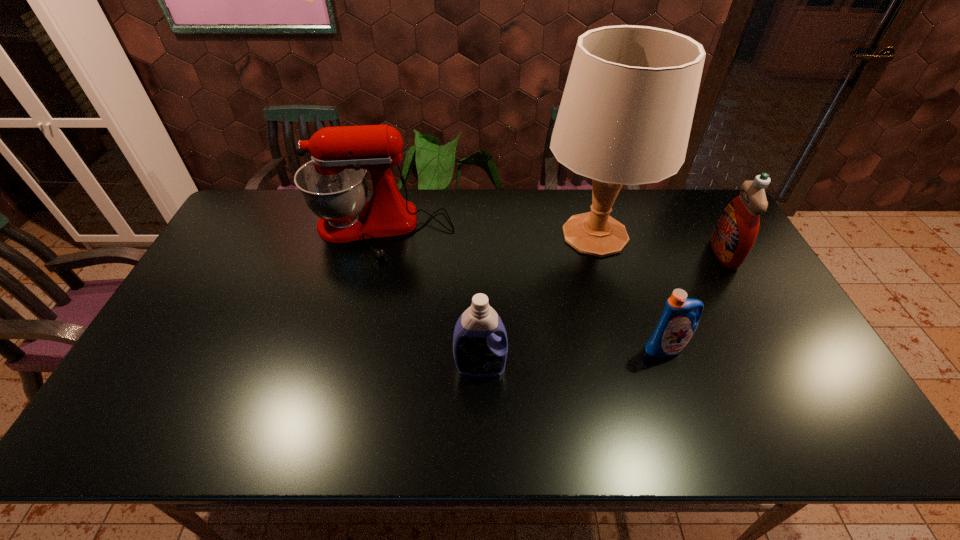
This screenshot has width=960, height=540. Find the location of `vacant space situated 0.250m on the front surface of the farthest detergent`. vacant space situated 0.250m on the front surface of the farthest detergent is located at coordinates (635, 254).

Where is `free region located 0.080m on the front surface of the farthest detergent`? This screenshot has height=540, width=960. free region located 0.080m on the front surface of the farthest detergent is located at coordinates (687, 254).

I want to click on vacant space situated 0.070m on the left of the fourth object from right to left, so tap(427, 367).

The height and width of the screenshot is (540, 960). Find the location of `vacant space located 0.070m on the label of the second detergent from left to right`. vacant space located 0.070m on the label of the second detergent from left to right is located at coordinates [678, 383].

The image size is (960, 540). I want to click on table lamp that is at the far edge, so [625, 117].

Identify the location of mixer located in the far edge section of the desktop. (334, 185).

This screenshot has width=960, height=540. Find the location of `object that is at the right edge`. object that is at the right edge is located at coordinates pos(734,235).

At what (x,y) coordinates should I click in order to perform the action: click on vacant region at the far edge of the desktop. Please return your answer as a coordinate pair (x, y). Image resolution: width=960 pixels, height=540 pixels. Looking at the image, I should click on (656, 207).

Identify the location of vacant space at the near edge of the desktop. (234, 428).

The height and width of the screenshot is (540, 960). Identify the location of vacant space at the left edge of the desktop. (260, 252).